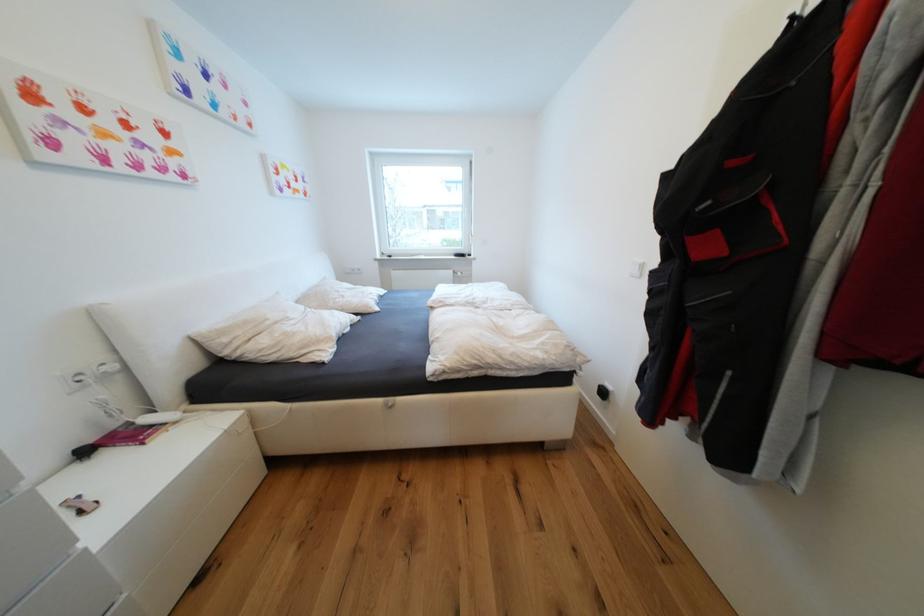
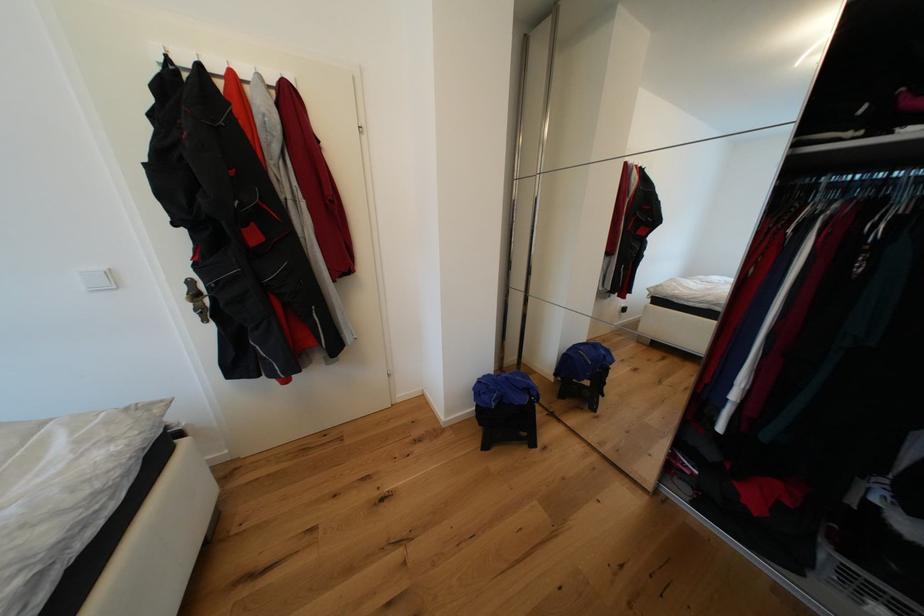
First-person continuous shooting, in which direction is the camera rotating?

The camera rotated toward right-down.